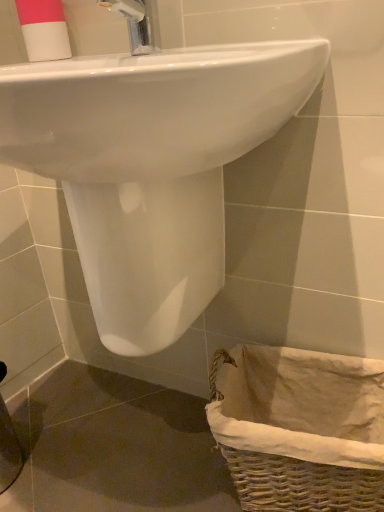
In order to click on pink matte cup at upper left in this screenshot , I will do `click(44, 29)`.

You are a GUI agent. You are given a task and a screenshot of the screen. Output one action in this format:
    pyautogui.click(x=<x>, y=<y>)
    Task: Click on the white glossy sink at upper center
    
    Given the screenshot: What is the action you would take?
    pyautogui.click(x=151, y=166)

I want to click on woven wicker basket at lower right, so click(300, 428).

Is white glossy sink at upper center inside or outside of pink matte cup at upper left?

white glossy sink at upper center is outside pink matte cup at upper left.

Is white glossy sink at upper center next to pink matte cup at upper left?

No, white glossy sink at upper center is not making contact with pink matte cup at upper left.

Considering the sizes of white glossy sink at upper center and pink matte cup at upper left in the image, is white glossy sink at upper center taller or shorter than pink matte cup at upper left?

white glossy sink at upper center is taller than pink matte cup at upper left.

Does white glossy sink at upper center come in front of pink matte cup at upper left?

Yes.

In the scene shown: Considering the relative positions of woven wicker basket at lower right and pink matte cup at upper left in the image provided, is woven wicker basket at lower right in front of pink matte cup at upper left?

Yes, the depth of woven wicker basket at lower right is less than that of pink matte cup at upper left.

In the scene shown: Considering the sizes of objects woven wicker basket at lower right and pink matte cup at upper left in the image provided, who is taller, woven wicker basket at lower right or pink matte cup at upper left?

woven wicker basket at lower right.

Is woven wicker basket at lower right surrounding pink matte cup at upper left?

No, woven wicker basket at lower right does not contain pink matte cup at upper left.

How many degrees apart are the facing directions of woven wicker basket at lower right and pink matte cup at upper left?

The angle between the facing direction of woven wicker basket at lower right and the facing direction of pink matte cup at upper left is 7.87 degrees.

Are woven wicker basket at lower right and white glossy sink at upper center making contact?

No, woven wicker basket at lower right is not touching white glossy sink at upper center.

Is woven wicker basket at lower right positioned before white glossy sink at upper center?

No, it is not.

Is woven wicker basket at lower right taller or shorter than white glossy sink at upper center?

Clearly, woven wicker basket at lower right is shorter compared to white glossy sink at upper center.

Would you say woven wicker basket at lower right is to the left or to the right of white glossy sink at upper center in the picture?

From the image, it's evident that woven wicker basket at lower right is to the right of white glossy sink at upper center.

Is point (42, 0) farther from viewer compared to point (320, 378)?

That is False.

From a real-world perspective, is pink matte cup at upper left below woven wicker basket at lower right?

No, from a real-world perspective, pink matte cup at upper left is not beneath woven wicker basket at lower right.

From the image's perspective, which is below, pink matte cup at upper left or woven wicker basket at lower right?

woven wicker basket at lower right, from the image's perspective.

Is pink matte cup at upper left bigger than woven wicker basket at lower right?

No, pink matte cup at upper left is not bigger than woven wicker basket at lower right.

Considering the positions of objects white glossy sink at upper center and woven wicker basket at lower right in the image provided, who is more to the right, white glossy sink at upper center or woven wicker basket at lower right?

woven wicker basket at lower right is more to the right.

Between white glossy sink at upper center and woven wicker basket at lower right, which one has less height?

Standing shorter between the two is woven wicker basket at lower right.

In the scene shown: Could you tell me if white glossy sink at upper center is facing woven wicker basket at lower right?

No.

From a real-world perspective, which object stands above the other?

pink matte cup at upper left.

Are pink matte cup at upper left and white glossy sink at upper center located far from each other?

pink matte cup at upper left is actually quite close to white glossy sink at upper center.

Considering the sizes of pink matte cup at upper left and white glossy sink at upper center in the image, is pink matte cup at upper left wider or thinner than white glossy sink at upper center?

Considering their sizes, pink matte cup at upper left looks slimmer than white glossy sink at upper center.

From the image's perspective, would you say pink matte cup at upper left is shown under white glossy sink at upper center?

Incorrect, from the image's perspective, pink matte cup at upper left is higher than white glossy sink at upper center.

The image size is (384, 512). I want to click on toiletry above the white glossy sink at upper center (from the image's perspective), so click(x=44, y=29).

Locate an element on the screen. This screenshot has height=512, width=384. toiletry behind the woven wicker basket at lower right is located at coordinates (44, 29).

Looking at the image, which one is located closer to woven wicker basket at lower right, white glossy sink at upper center or pink matte cup at upper left?

The object closer to woven wicker basket at lower right is white glossy sink at upper center.

Considering their positions, is white glossy sink at upper center positioned further to pink matte cup at upper left than woven wicker basket at lower right?

Among the two, woven wicker basket at lower right is located further to pink matte cup at upper left.

Considering their positions, is pink matte cup at upper left positioned closer to woven wicker basket at lower right than white glossy sink at upper center?

Based on the image, white glossy sink at upper center appears to be nearer to woven wicker basket at lower right.

Looking at the image, which one is located closer to white glossy sink at upper center, woven wicker basket at lower right or pink matte cup at upper left?

woven wicker basket at lower right is closer to white glossy sink at upper center.

Based on their spatial positions, is pink matte cup at upper left or woven wicker basket at lower right closer to white glossy sink at upper center?

Among the two, woven wicker basket at lower right is located nearer to white glossy sink at upper center.

Looking at the image, which one is located closer to pink matte cup at upper left, woven wicker basket at lower right or white glossy sink at upper center?

The object closer to pink matte cup at upper left is white glossy sink at upper center.

The height and width of the screenshot is (512, 384). In order to click on sink between pink matte cup at upper left and woven wicker basket at lower right in the up-down direction in this screenshot , I will do `click(151, 166)`.